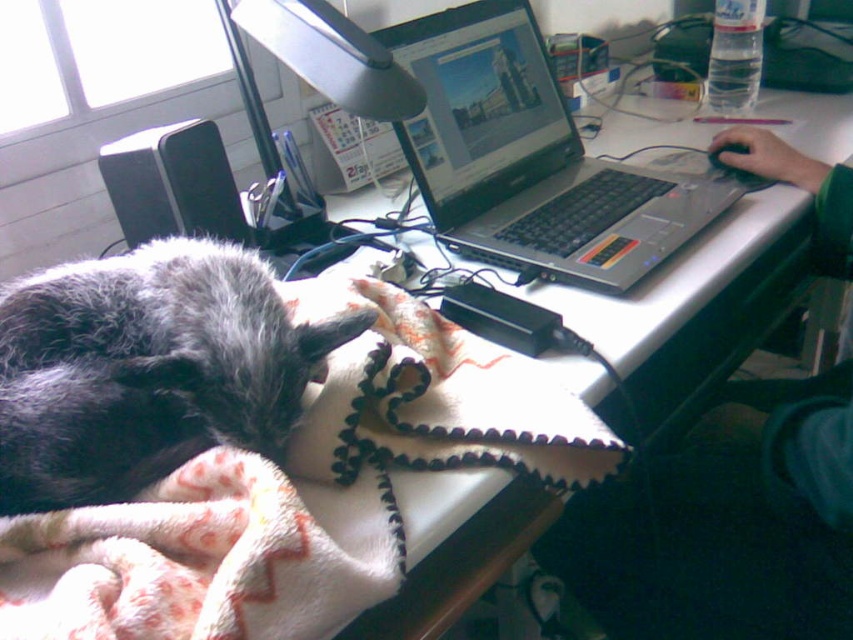
What do you see at coordinates (146, 369) in the screenshot? I see `fluffy gray cat at lower left` at bounding box center [146, 369].

Does fluffy gray cat at lower left appear over silver/black plastic laptop at center?

No.

You are a GUI agent. You are given a task and a screenshot of the screen. Output one action in this format:
    pyautogui.click(x=<x>, y=<y>)
    Task: Click on the fluffy gray cat at lower left
    
    Given the screenshot: What is the action you would take?
    pyautogui.click(x=146, y=369)

Between white fleece blanket at lower left and silver/black plastic laptop at center, which one is positioned higher?

silver/black plastic laptop at center is higher up.

Can you confirm if white fleece blanket at lower left is bigger than silver/black plastic laptop at center?

No.

Measure the distance between white fleece blanket at lower left and camera.

white fleece blanket at lower left and camera are 18.47 inches apart from each other.

Find the location of `white fleece blanket at lower left`. white fleece blanket at lower left is located at coordinates pos(300,492).

Is white fleece blanket at lower left bigger than fluffy gray cat at lower left?

Actually, white fleece blanket at lower left might be smaller than fluffy gray cat at lower left.

Who is positioned more to the right, white fleece blanket at lower left or fluffy gray cat at lower left?

white fleece blanket at lower left is more to the right.

Does point (294, 520) come closer to viewer compared to point (167, 262)?

That is True.

You are a GUI agent. You are given a task and a screenshot of the screen. Output one action in this format:
    pyautogui.click(x=<x>, y=<y>)
    Task: Click on the white fleece blanket at lower left
    
    Given the screenshot: What is the action you would take?
    pyautogui.click(x=300, y=492)